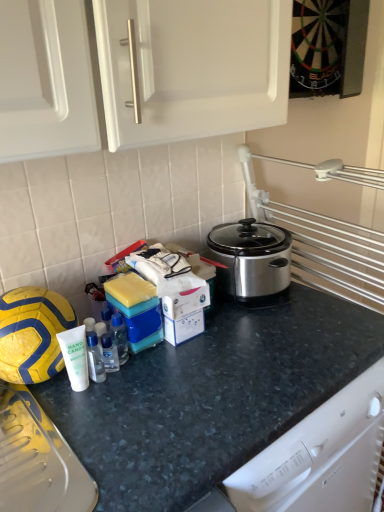
Question: From the image's perspective, is transparent plastic bottle at center, marked as the first bottle in a back-to-front arrangement, located above or below clear plastic bottle at center, which appears as the 2th bottle when viewed from the back?

Choices:
 (A) above
 (B) below

Answer: (A)

Question: In terms of height, does transparent plastic bottle at center, arranged as the 2th bottle when viewed from the front, look taller or shorter compared to clear plastic bottle at center, which appears as the 2th bottle when viewed from the back?

Choices:
 (A) tall
 (B) short

Answer: (A)

Question: Which is nearer to the dark gray granite countertop at center?

Choices:
 (A) transparent plastic bottle at center, arranged as the 2th bottle when viewed from the front
 (B) clear plastic bottle at center, the 1th bottle in the left-to-right sequence
 (C) yellow matte football at left

Answer: (A)

Question: Which of these objects is positioned farthest from the transparent plastic bottle at center, marked as the first bottle in a back-to-front arrangement?

Choices:
 (A) dark gray granite countertop at center
 (B) yellow matte football at left
 (C) clear plastic bottle at center, which is the 2th bottle in right-to-left order

Answer: (A)